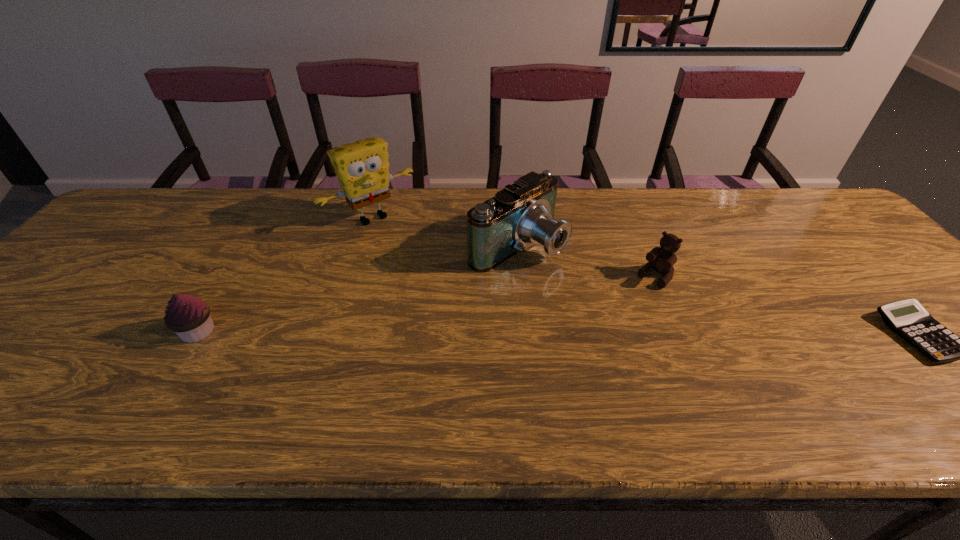
You are a GUI agent. You are given a task and a screenshot of the screen. Output one action in this format:
    pyautogui.click(x=<x>, y=<y>)
    Task: Click on the vacant position at the right edge of the desktop
    
    Given the screenshot: What is the action you would take?
    pyautogui.click(x=875, y=300)

This screenshot has height=540, width=960. Find the location of `vacant space at the near left corner of the desktop`. vacant space at the near left corner of the desktop is located at coordinates (50, 357).

This screenshot has width=960, height=540. Identify the location of empty space that is in between the third object from right to left and the cupcake. (358, 288).

In order to click on empty space that is in between the leftmost object and the second object from left to right in this screenshot , I will do `click(285, 274)`.

You are a GUI agent. You are given a task and a screenshot of the screen. Output one action in this format:
    pyautogui.click(x=<x>, y=<y>)
    Task: Click on the free space that is in between the teddy bear and the second tallest object
    
    Given the screenshot: What is the action you would take?
    pyautogui.click(x=587, y=261)

Where is `vacant area that lies between the cupcake and the teddy bear`? vacant area that lies between the cupcake and the teddy bear is located at coordinates (426, 304).

At what (x,y) coordinates should I click in order to perform the action: click on vacant area that lies between the sponge and the camcorder. Please return your answer as a coordinate pair (x, y). The height and width of the screenshot is (540, 960). Looking at the image, I should click on (444, 231).

Locate an element on the screen. The width and height of the screenshot is (960, 540). free spot between the fourth shortest object and the second object from right to left is located at coordinates (587, 261).

Where is `empty space between the cupcake and the fourth object from left to right`? empty space between the cupcake and the fourth object from left to right is located at coordinates (426, 304).

Identify the location of object that is the fourth nearest to the shortest object. The width and height of the screenshot is (960, 540). (189, 317).